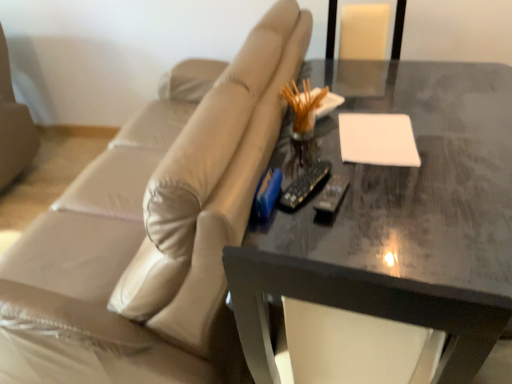
At what (x,y) coordinates should I click in order to perform the action: click on free space between black plastic remote at center and white matte notepad at upper right. Please return your answer as a coordinate pair (x, y). The height and width of the screenshot is (384, 512). Looking at the image, I should click on (345, 166).